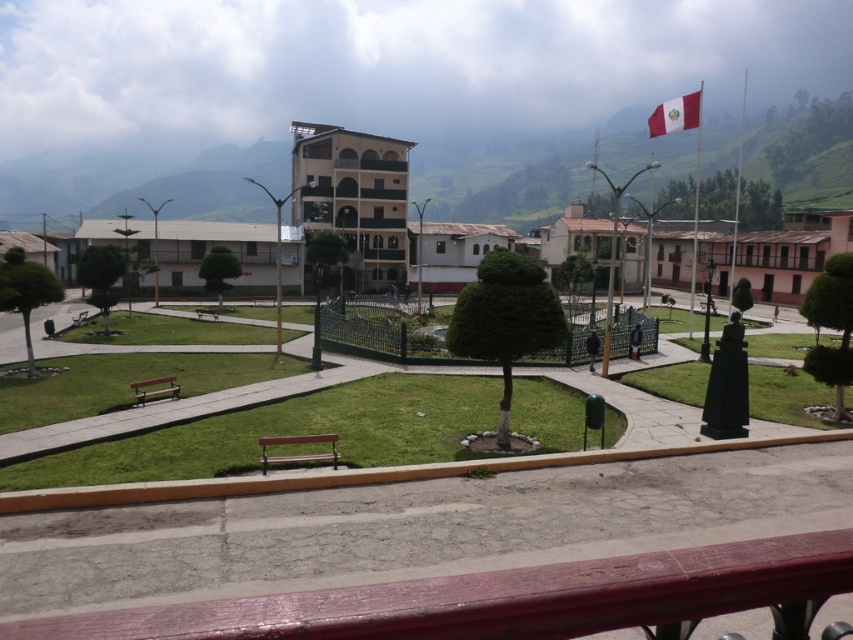
From the picture: Who is higher up, green grassy hillside at upper center or brown wooden bench at center?

green grassy hillside at upper center

How distant is green grassy hillside at upper center from brown wooden bench at center?

They are 152.03 meters apart.

Who is more distant from viewer, [834,193] or [323,456]?

Point [834,193]

Identify the location of green grassy hillside at upper center. The image size is (853, 640). (502, 180).

Does red fabric flag at upper right appear over wooden park bench at center?

Yes, red fabric flag at upper right is above wooden park bench at center.

Image resolution: width=853 pixels, height=640 pixels. What do you see at coordinates (675, 115) in the screenshot?
I see `red fabric flag at upper right` at bounding box center [675, 115].

Does point (698, 92) lie in front of point (204, 308)?

No.

What are the coordinates of `red fabric flag at upper right` in the screenshot? It's located at (675, 115).

Is smooth wood bench at lower center to the left of wooden park bench at center from the viewer's perspective?

Incorrect, smooth wood bench at lower center is not on the left side of wooden park bench at center.

Does point (339, 604) come farther from viewer compared to point (210, 312)?

No, (339, 604) is in front of (210, 312).

At what (x,y) coordinates should I click in order to perform the action: click on smooth wood bench at lower center. Please return your answer as a coordinate pair (x, y). The image size is (853, 640). Looking at the image, I should click on (511, 600).